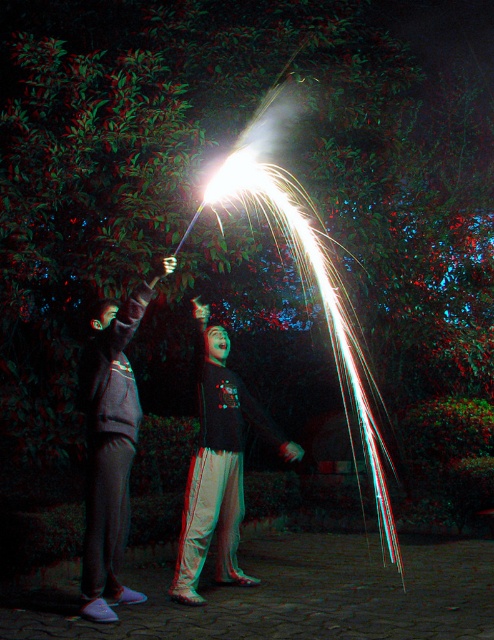
Which of these two, gray sweatpants at left or black matte shirt at center, stands shorter?

black matte shirt at center

Measure the distance between point (x=153, y=288) and camera.

A: Point (x=153, y=288) is 15.02 feet away from camera.

At what (x,y) coordinates should I click in order to perform the action: click on gray sweatpants at left. Please return your answer as a coordinate pair (x, y). Looking at the image, I should click on (111, 445).

Image resolution: width=494 pixels, height=640 pixels. In order to click on gray sweatpants at left in this screenshot , I will do `click(111, 445)`.